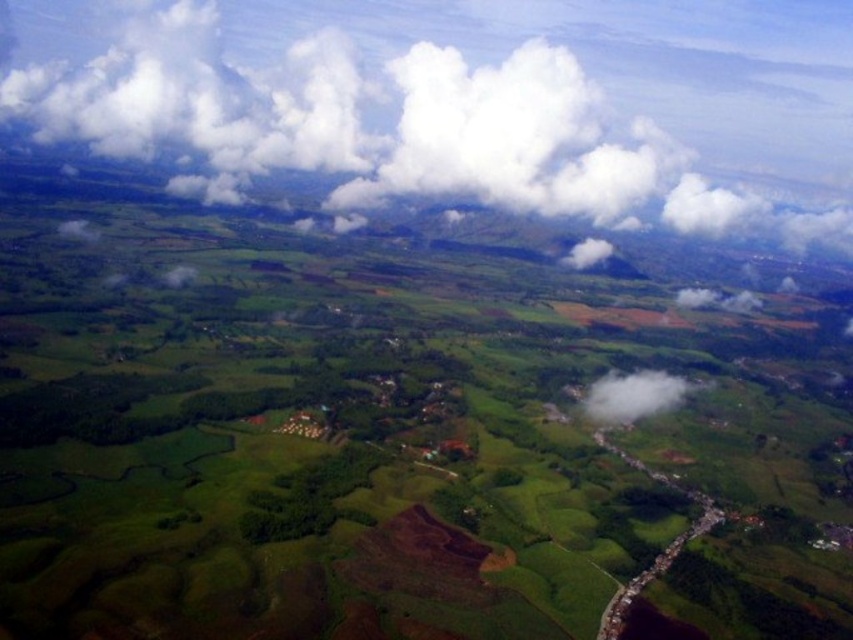
Question: Does green grassy field at center have a lesser width compared to white fluffy cloud at center?

Choices:
 (A) no
 (B) yes

Answer: (A)

Question: Which object is farther from the camera taking this photo?

Choices:
 (A) white fluffy cloud at center
 (B) green grassy field at center

Answer: (A)

Question: Does white fluffy cloud at upper center have a smaller size compared to white fluffy cloud at center?

Choices:
 (A) yes
 (B) no

Answer: (B)

Question: Considering the real-world distances, which object is farthest from the white fluffy cloud at center?

Choices:
 (A) green grassy field at center
 (B) white fluffy cloud at upper center

Answer: (B)

Question: Observing the image, what is the correct spatial positioning of green grassy field at center in reference to white fluffy cloud at center?

Choices:
 (A) left
 (B) right

Answer: (A)

Question: Estimate the real-world distances between objects in this image. Which object is closer to the white fluffy cloud at upper center?

Choices:
 (A) white fluffy cloud at center
 (B) green grassy field at center

Answer: (B)